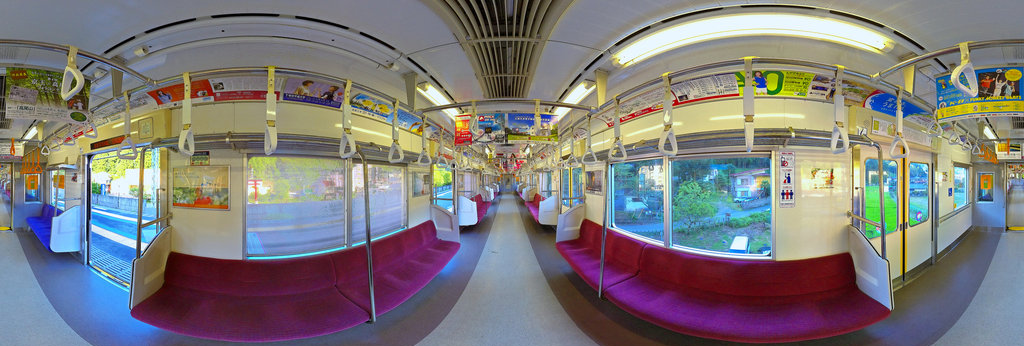
The height and width of the screenshot is (346, 1024). In order to click on seat divider in this screenshot , I will do `click(872, 269)`.